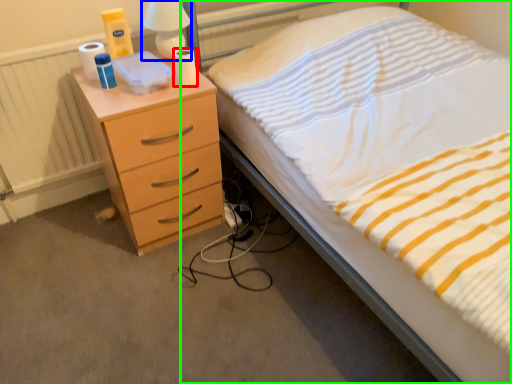
Question: Based on their relative distances, which object is farther from toilet paper (highlighted by a red box)? Choose from bedside lamp (highlighted by a blue box) and bed (highlighted by a green box).

Choices:
 (A) bedside lamp
 (B) bed

Answer: (B)